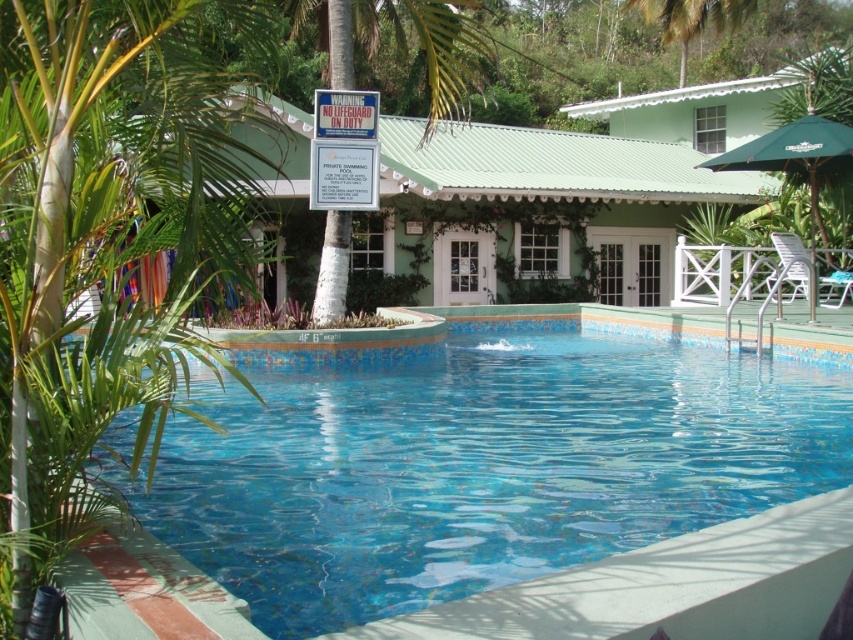
Question: Observing the image, what is the correct spatial positioning of green matte building at upper center in reference to green leafy palm tree at upper center?

Choices:
 (A) below
 (B) above

Answer: (A)

Question: Which object is the farthest from the green leafy palm tree at upper center?

Choices:
 (A) green matte building at upper center
 (B) blue mosaic tiles at center
 (C) green leafy palm tree at left
 (D) green fabric umbrella at upper right

Answer: (C)

Question: Which is farther from the green matte building at upper center?

Choices:
 (A) green fabric umbrella at upper right
 (B) blue mosaic tiles at center

Answer: (B)

Question: Is blue mosaic tiles at center behind green fabric umbrella at upper right?

Choices:
 (A) no
 (B) yes

Answer: (A)

Question: Which object is farther from the camera taking this photo?

Choices:
 (A) blue mosaic tiles at center
 (B) green leafy palm tree at left
 (C) green fabric umbrella at upper right

Answer: (C)

Question: Is green fabric umbrella at upper right smaller than green leafy palm tree at upper center?

Choices:
 (A) yes
 (B) no

Answer: (B)